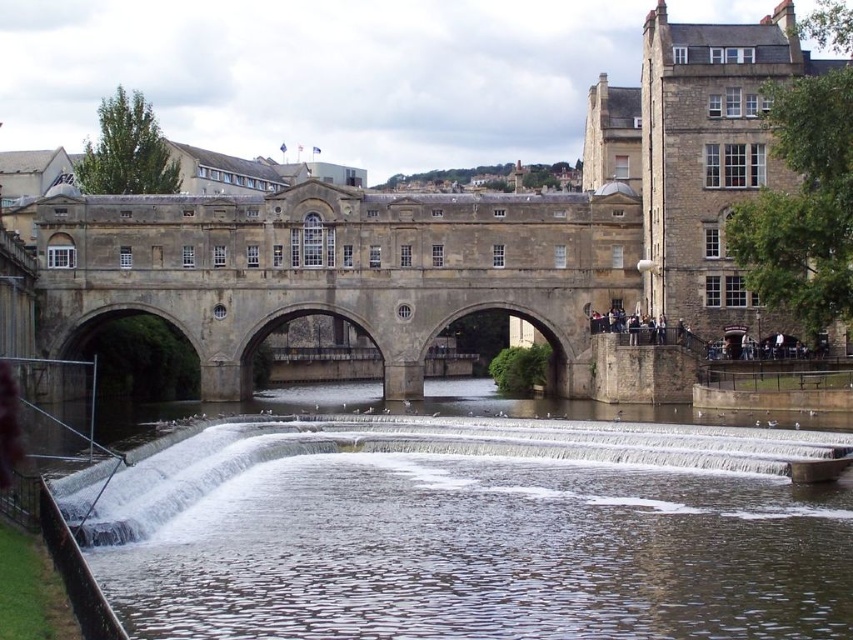
Question: Is brown stone river at lower center below stone bridge at center?

Choices:
 (A) no
 (B) yes

Answer: (B)

Question: Among these points, which one is nearest to the camera?

Choices:
 (A) (538, 218)
 (B) (178, 465)

Answer: (B)

Question: Can you confirm if brown stone river at lower center is thinner than stone bridge at center?

Choices:
 (A) no
 (B) yes

Answer: (B)

Question: Which point appears closest to the camera in this image?

Choices:
 (A) (115, 563)
 (B) (309, 272)

Answer: (A)

Question: Is the position of brown stone river at lower center less distant than that of stone bridge at center?

Choices:
 (A) no
 (B) yes

Answer: (B)